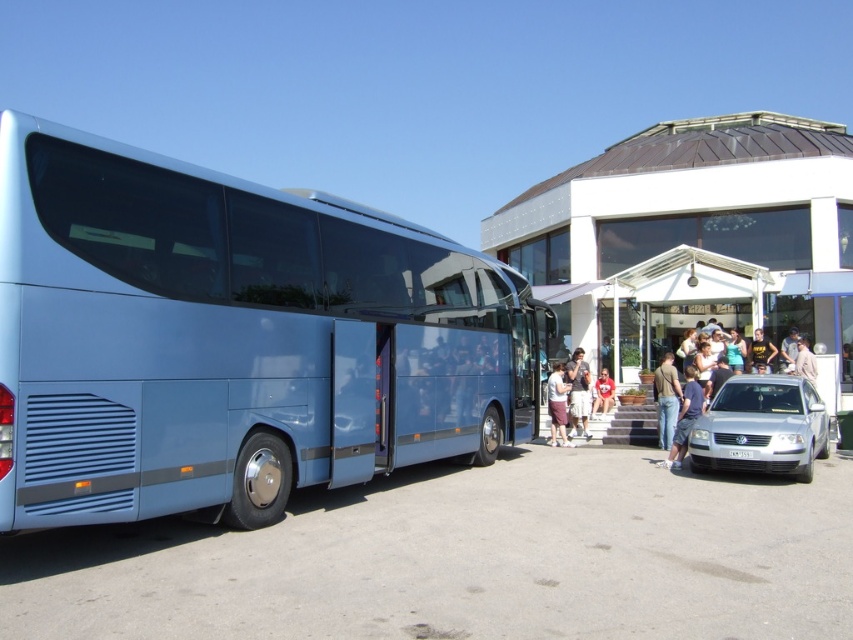
Question: Which object appears farthest from the camera in this image?

Choices:
 (A) metallic blue bus at left
 (B) light brown leather jacket at lower right
 (C) red cotton shirt at center

Answer: (C)

Question: Which of these objects is positioned closest to the black fabric shirt at center?

Choices:
 (A) light brown leather jacket at lower right
 (B) light blue fabric shirt at center
 (C) white plastic license plate at lower center

Answer: (A)

Question: Is denim jeans at center smaller than black fabric shirt at center?

Choices:
 (A) yes
 (B) no

Answer: (A)

Question: Can you confirm if white glossy sedan at lower right is smaller than light blue fabric shirt at center?

Choices:
 (A) yes
 (B) no

Answer: (B)

Question: Based on their relative distances, which object is nearer to the light brown fabric pants at center?

Choices:
 (A) metallic blue bus at left
 (B) black fabric shirt at center
 (C) light brown leather jacket at lower right
 (D) jeans at lower right

Answer: (D)

Question: Where is denim jeans at center located in relation to light blue fabric shirt at center in the image?

Choices:
 (A) below
 (B) above

Answer: (A)